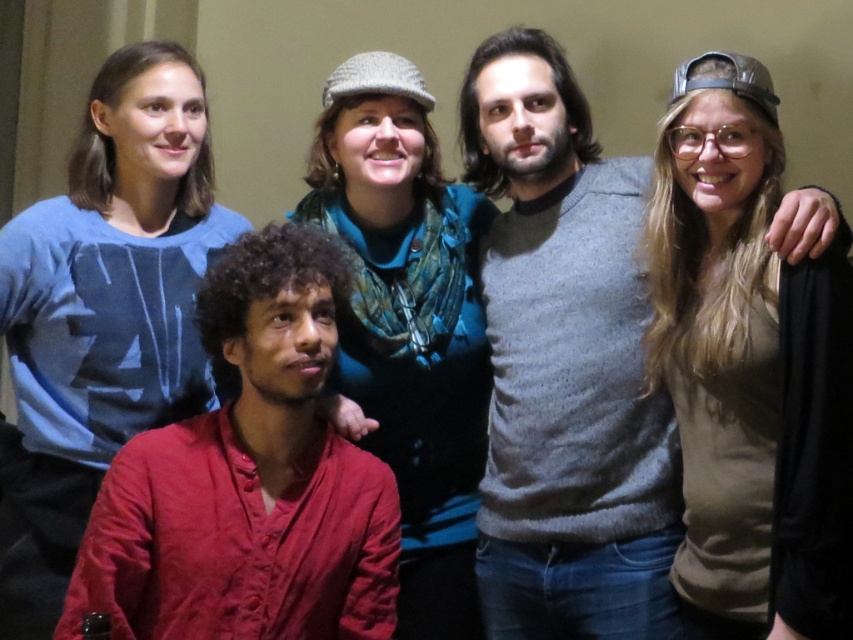
Is red linen shirt at lower left smaller than knitted wool hat at upper center?

Incorrect, red linen shirt at lower left is not smaller in size than knitted wool hat at upper center.

From the picture: Which is more to the right, red linen shirt at lower left or knitted wool hat at upper center?

knitted wool hat at upper center is more to the right.

Who is more forward, (253, 588) or (422, 148)?

Point (253, 588) is in front.

What are the coordinates of `red linen shirt at lower left` in the screenshot? It's located at (248, 480).

Can you confirm if gray sweater at center is shorter than knitted wool hat at upper center?

Incorrect, gray sweater at center's height does not fall short of knitted wool hat at upper center's.

Is gray sweater at center below knitted wool hat at upper center?

Incorrect, gray sweater at center is not positioned below knitted wool hat at upper center.

Does point (566, 232) come closer to viewer compared to point (463, 218)?

Yes, point (566, 232) is in front of point (463, 218).

Where is `gray sweater at center`? gray sweater at center is located at coordinates (566, 364).

In the scene shown: Can you confirm if gray sweater at center is thinner than red linen shirt at lower left?

Correct, gray sweater at center's width is less than red linen shirt at lower left's.

Does point (548, 140) lie in front of point (189, 604)?

No, (548, 140) is further to viewer.

Which is in front, point (578, 205) or point (111, 531)?

Point (111, 531) is in front.

Identify the location of gray sweater at center. This screenshot has width=853, height=640. pos(566,364).